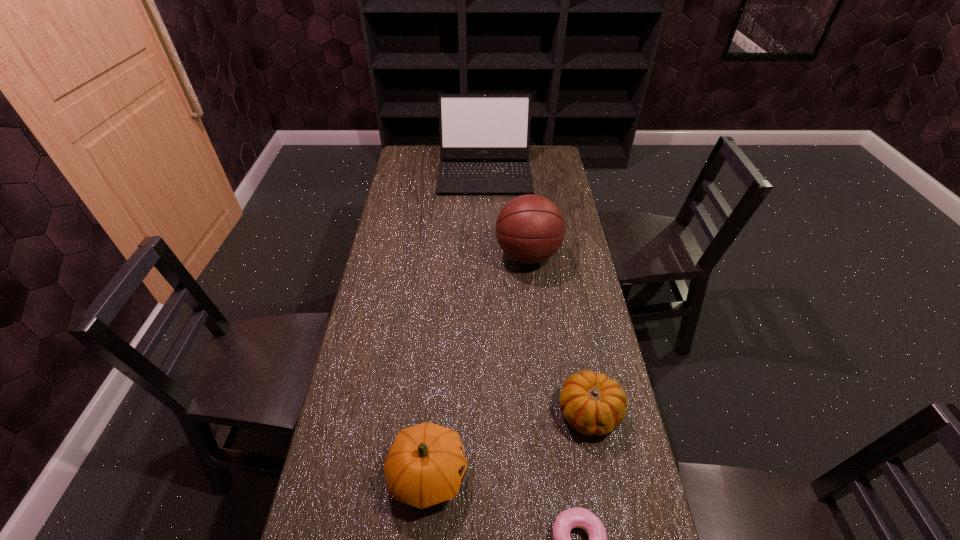
Image resolution: width=960 pixels, height=540 pixels. In order to click on free location located on the side of the left gourd with the carved face in this screenshot , I will do `click(624, 474)`.

Locate an element on the screen. blank area located 0.180m on the back of the right gourd is located at coordinates (575, 333).

The width and height of the screenshot is (960, 540). I want to click on object present at the far edge, so click(x=484, y=138).

Where is `object that is at the left edge`? object that is at the left edge is located at coordinates (425, 466).

Locate an element on the screen. This screenshot has height=540, width=960. laptop located in the right edge section of the desktop is located at coordinates (484, 138).

Identify the location of basketball at the right edge. (530, 229).

Where is `gourd situated at the right edge`? Image resolution: width=960 pixels, height=540 pixels. gourd situated at the right edge is located at coordinates (593, 404).

Identify the location of object that is at the far right corner. The image size is (960, 540). (484, 138).

The height and width of the screenshot is (540, 960). What are the coordinates of `vacant position at the left edge of the desktop` in the screenshot? It's located at coord(351,517).

Find the location of `vacant point at the far left corner`. vacant point at the far left corner is located at coordinates (417, 158).